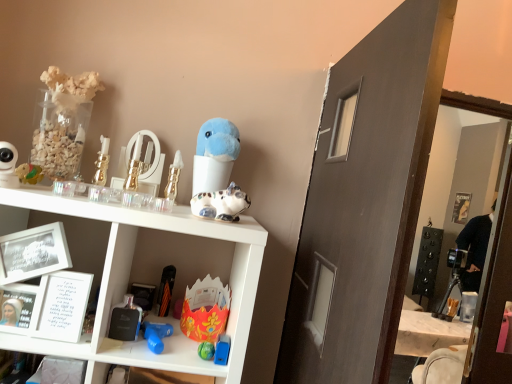
Question: Considering the relative positions of white matte picture frame at left and orange matte umbrella at lower center, positioned as the 8th toy in right-to-left order, in the image provided, is white matte picture frame at left to the left or to the right of orange matte umbrella at lower center, positioned as the 8th toy in right-to-left order,?

Choices:
 (A) left
 (B) right

Answer: (A)

Question: In the image, is white matte picture frame at left positioned in front of or behind orange matte umbrella at lower center, positioned as the 8th toy in right-to-left order?

Choices:
 (A) behind
 (B) front

Answer: (B)

Question: Estimate the real-world distances between objects in this image. Which object is closer to the orange matte umbrella at lower center, positioned as the 8th toy in right-to-left order?

Choices:
 (A) matte brown door at center
 (B) metallic gold perfume bottle at center, arranged as the sixth toy when viewed from the right
 (C) white glossy ceramic cat at center, the second toy viewed from the right
 (D) matte white camera at left, the second toy from the left
 (E) shiny green ball at lower center, which is counted as the 3th toy, starting from the right

Answer: (E)

Question: Estimate the real-world distances between objects in this image. Which object is farther from the shiny plastic toy at left, acting as the first toy starting from the left?

Choices:
 (A) blue rubber toy at lower center, acting as the fifth toy starting from the left
 (B) shiny green ball at lower center, which is counted as the 3th toy, starting from the right
 (C) floral paper crown at center, which is the 7th toy in left-to-right order
 (D) gold metallic mirror at upper center
 (E) gold metallic candle at center, which is the third toy from left to right

Answer: (B)